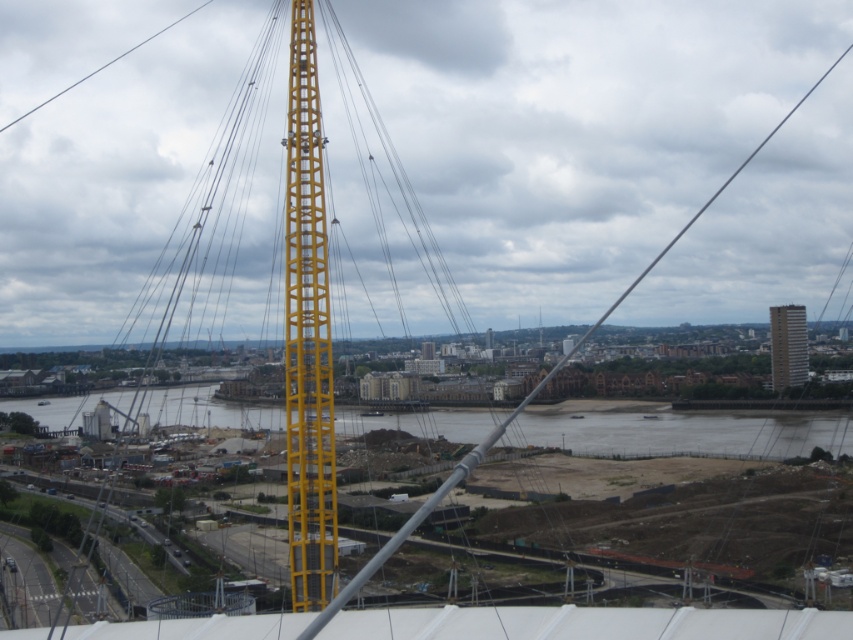
Consider the image. You are standing at the point marked as point (677,429) in the cityscape image. What type of terrain are you currently standing on?

The point (677,429) is on brown sand at lower center, so you are standing on brown sand.

You are a photographer standing at the edge of the river in the cityscape scene. You want to take a photo that includes both the yellow tower and the boats on the river. Which of the two points, point (173, 404) or point (341, 531), is closer to your camera position?

Point (173, 404) is further to the camera than point (341, 531), so point (341, 531) is closer to your camera position.